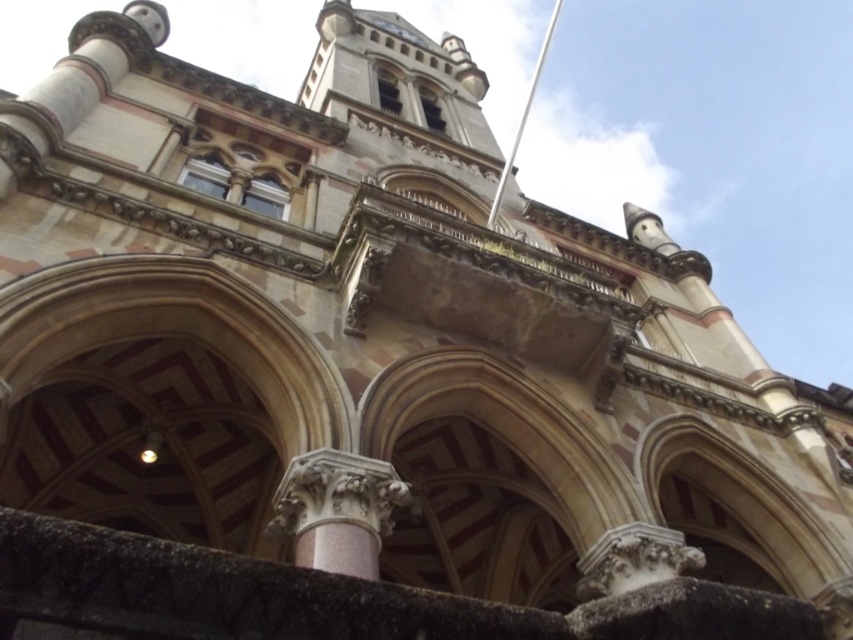
You are standing in front of the building and want to take a photo that includes both the pink stone column at center and the white metallic flag pole at upper center. Which object will appear larger in your photo?

The pink stone column at center will appear larger in the photo because it is closer to the viewer than the white metallic flag pole at upper center.

You are a tourist standing at the base of this ornate building, looking up. You notice the pink stone column at center and the white metallic flag pole at upper center. Which object is closer to the left side of the building?

The pink stone column at center is positioned on the left side of the white metallic flag pole at upper center, so it is closer to the left side of the building.